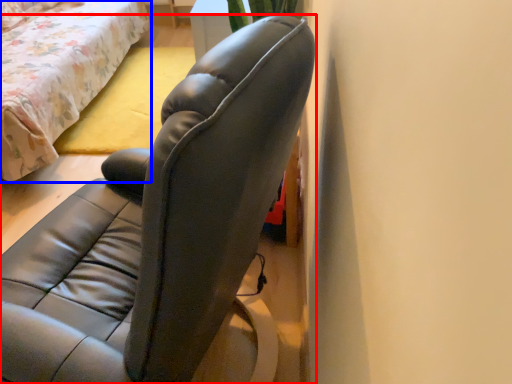
Question: Which object appears closest to the camera in this image, chair (highlighted by a red box) or bed (highlighted by a blue box)?

Choices:
 (A) chair
 (B) bed

Answer: (A)